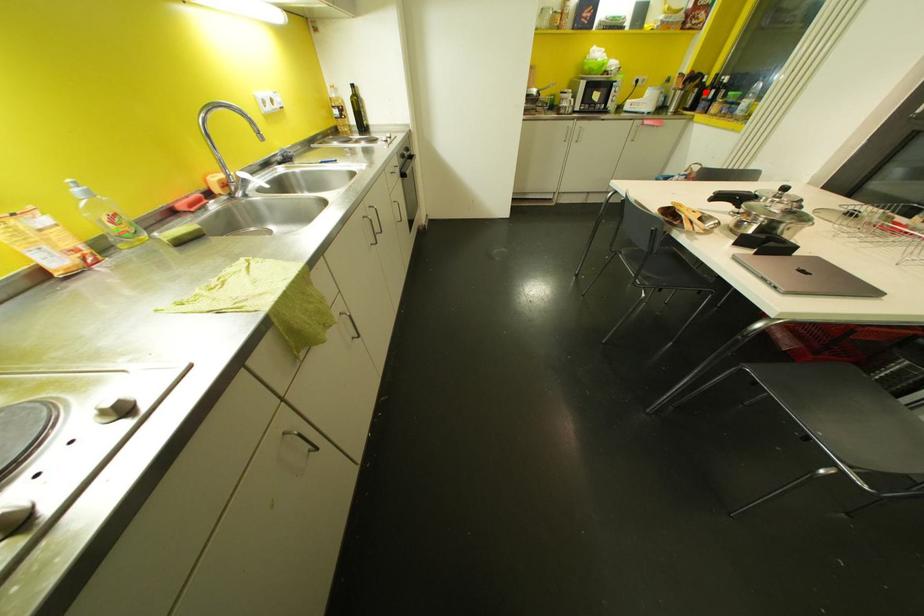
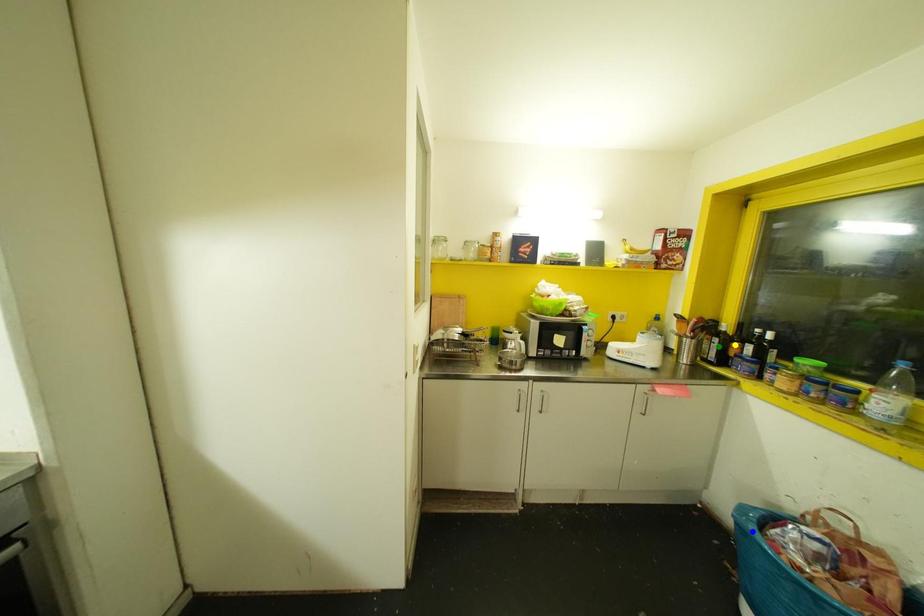
Question: I am providing you with two images of the same scene from different viewpoints. A red point is marked on the first image. You are given multiple points on the second image. Which mark in image 2 goes with the point in image 1?

Choices:
 (A) blue point
 (B) green point
 (C) yellow point

Answer: (C)